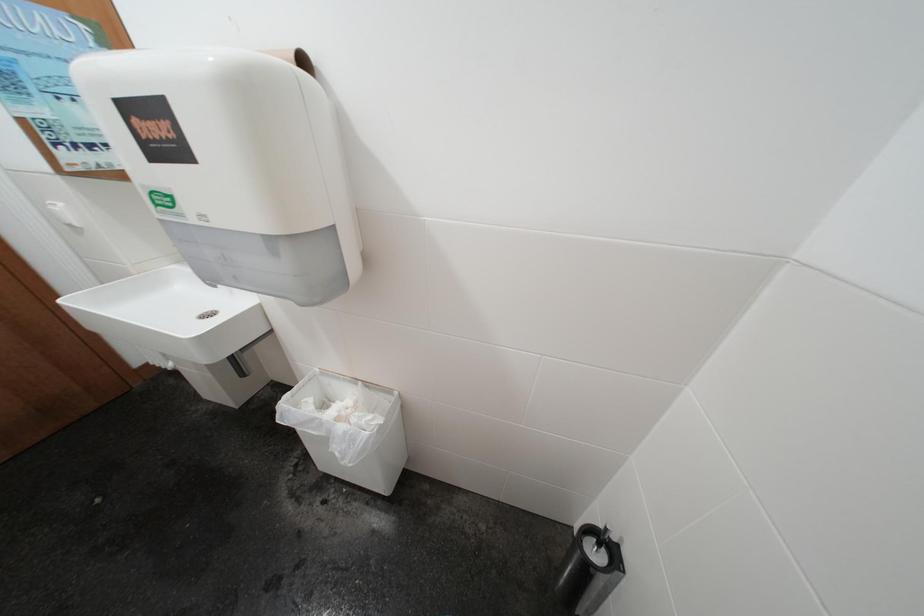
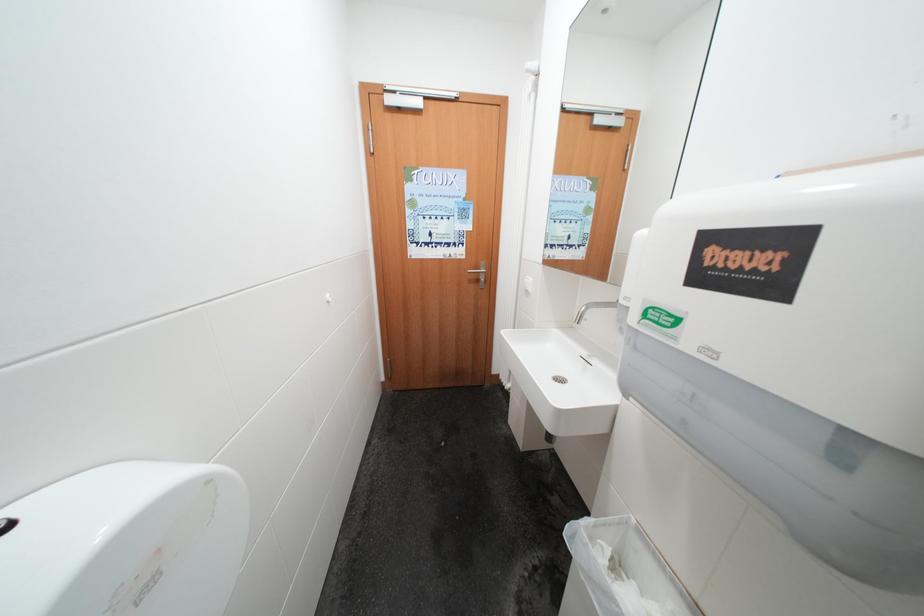
Question: How did the camera likely rotate?

Choices:
 (A) Left
 (B) Right
 (C) Up
 (D) Down

Answer: (A)